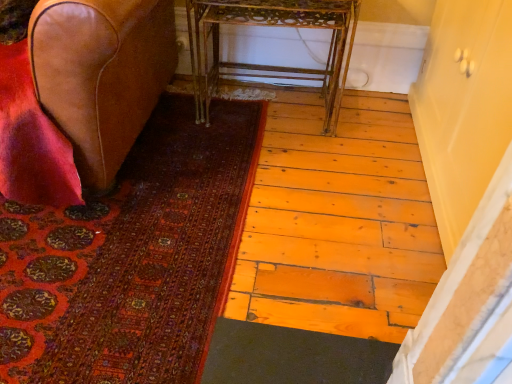
Question: Is leather at left directly adjacent to metallic gold table at center?

Choices:
 (A) no
 (B) yes

Answer: (A)

Question: Can you confirm if leather at left is smaller than metallic gold table at center?

Choices:
 (A) yes
 (B) no

Answer: (B)

Question: Is metallic gold table at center at the back of leather at left?

Choices:
 (A) yes
 (B) no

Answer: (B)

Question: Is leather at left aimed at metallic gold table at center?

Choices:
 (A) no
 (B) yes

Answer: (A)

Question: Does leather at left come behind metallic gold table at center?

Choices:
 (A) yes
 (B) no

Answer: (B)

Question: Is leather at left situated inside matte cream cabinet at right or outside?

Choices:
 (A) outside
 (B) inside

Answer: (A)

Question: Is point (97, 31) closer or farther from the camera than point (438, 145)?

Choices:
 (A) closer
 (B) farther

Answer: (A)

Question: Would you say leather at left is to the left or to the right of matte cream cabinet at right in the picture?

Choices:
 (A) left
 (B) right

Answer: (A)

Question: From the image's perspective, is leather at left located above or below matte cream cabinet at right?

Choices:
 (A) below
 (B) above

Answer: (B)

Question: Looking at their shapes, would you say metallic gold table at center is wider or thinner than leather at left?

Choices:
 (A) wide
 (B) thin

Answer: (B)

Question: Considering the positions of metallic gold table at center and leather at left in the image, is metallic gold table at center taller or shorter than leather at left?

Choices:
 (A) short
 (B) tall

Answer: (A)

Question: From the image's perspective, relative to leather at left, is metallic gold table at center above or below?

Choices:
 (A) below
 (B) above

Answer: (B)

Question: Visually, is metallic gold table at center positioned to the left or to the right of leather at left?

Choices:
 (A) left
 (B) right

Answer: (B)

Question: From a real-world perspective, is matte cream cabinet at right physically located above or below metallic gold table at center?

Choices:
 (A) above
 (B) below

Answer: (A)

Question: Does point (456, 1) appear closer or farther from the camera than point (326, 4)?

Choices:
 (A) closer
 (B) farther

Answer: (A)